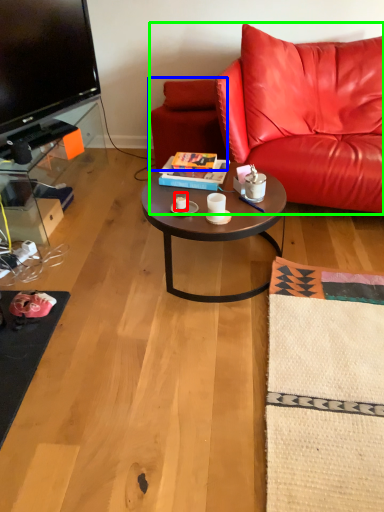
Question: Considering the real-world distances, which object is closest to coffee cup (highlighted by a red box)? swivel chair (highlighted by a blue box) or studio couch (highlighted by a green box).

Choices:
 (A) swivel chair
 (B) studio couch

Answer: (A)